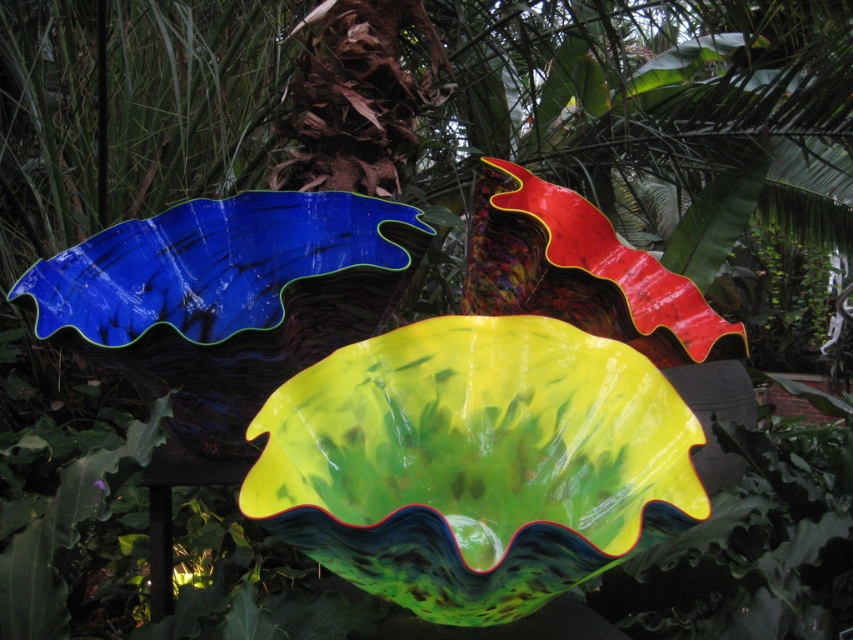
You are standing in front of the vibrant installation and want to take a photo. You notice two points marked in the scene at coordinates point (525, 435) and point (544, 246). Which point is closer to you?

Point (525, 435) is in front of point (544, 246), so it is closer to you.

You are an artist trying to place a new sculpture between the green glossy glass bowl at center and the shiny red glass leaf at center. If the new sculpture is 1.2 meters wide, will it fit between them without overlapping?

The green glossy glass bowl at center has a lesser width compared to shiny red glass leaf at center. Since the sculpture is 1.2 meters wide, but the distance between them isn

You are an art curator standing in front of the installation and want to place a small decorative item between the green glossy glass bowl at center and the shiny red glass leaf at center. Which object should you place it closer to so that it appears in front of both?

You should place the decorative item closer to the green glossy glass bowl at center because it is already closer to the viewer than the shiny red glass leaf at center, so positioning the item near it will place it in front of both objects.